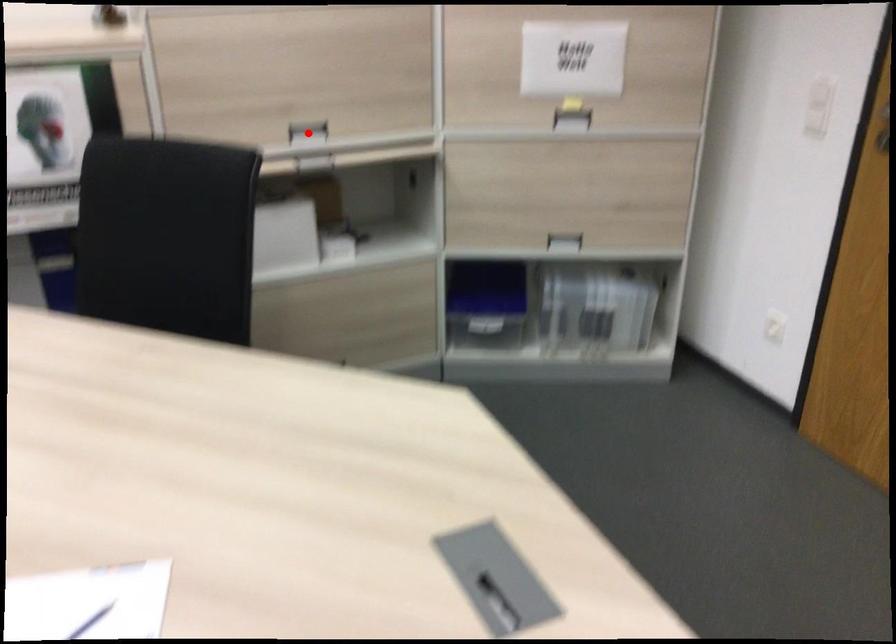
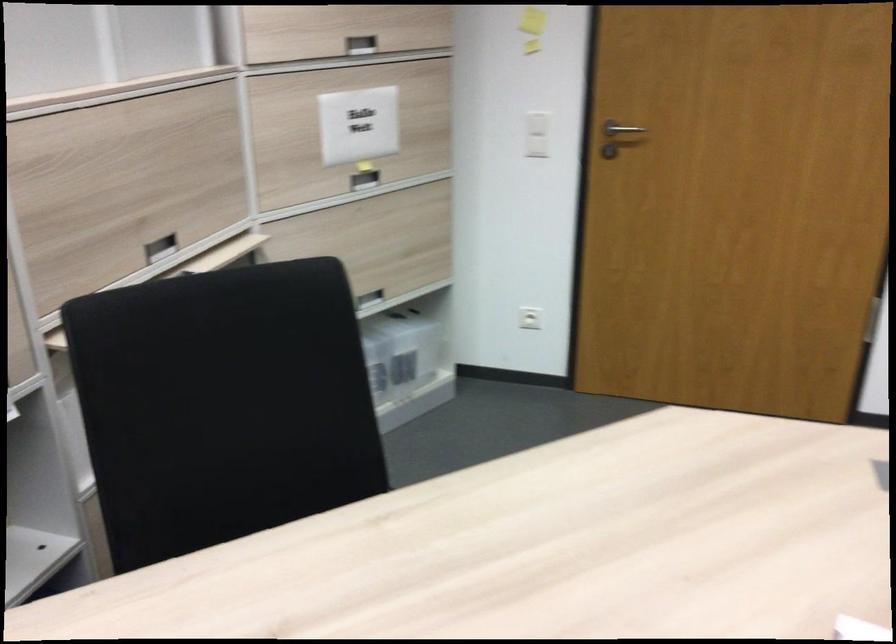
Question: I am providing you with two images of the same scene from different viewpoints. In image1, a red point is highlighted. Considering the same 3D point in image2, which of the following is correct?

Choices:
 (A) It is closer
 (B) It is farther

Answer: (A)